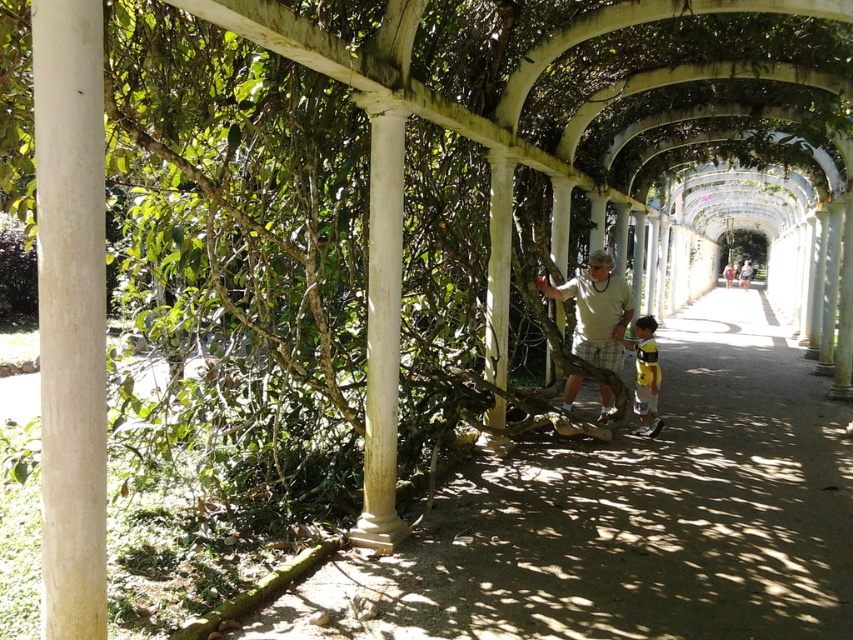
Question: Which object is positioned closest to the yellow fabric shirt at center?

Choices:
 (A) white smooth column at left
 (B) smooth concrete path at center
 (C) light brown plaid shorts at center

Answer: (C)

Question: Observing the image, what is the correct spatial positioning of smooth concrete path at center in reference to light brown plaid shorts at center?

Choices:
 (A) above
 (B) below

Answer: (B)

Question: Which point is closer to the camera taking this photo?

Choices:
 (A) (619, 356)
 (B) (650, 397)

Answer: (B)

Question: Among these objects, which one is nearest to the camera?

Choices:
 (A) light brown plaid shorts at center
 (B) yellow fabric shirt at center
 (C) white smooth column at left
 (D) smooth concrete path at center

Answer: (C)

Question: Observing the image, what is the correct spatial positioning of light brown plaid shorts at center in reference to yellow fabric shirt at center?

Choices:
 (A) above
 (B) below

Answer: (A)

Question: Does white smooth column at left appear under light brown plaid shorts at center?

Choices:
 (A) yes
 (B) no

Answer: (B)